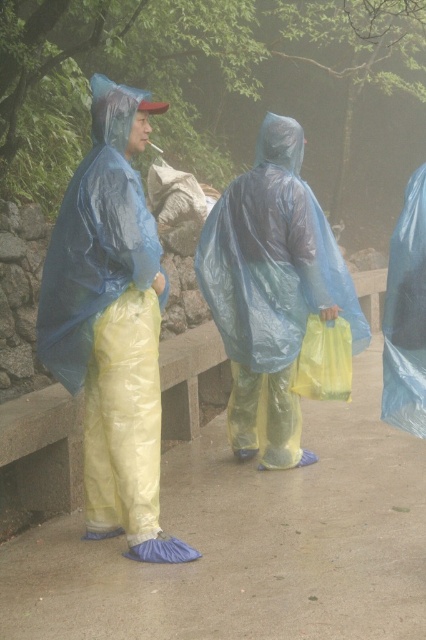
You are a photographer trying to capture the person in the matte blue raincoat at left. Given that the camera is focused on the point at coordinates (x=112, y=324), will the person in the matte blue raincoat at left be in focus?

The matte blue raincoat at left is represented by point (x=112, y=324), so yes, the person in the matte blue raincoat at left will be in focus since the camera is focused on that exact point.

You are a delivery person trying to locate the matte blue raincoat at left in a misty park. Based on the coordinates provided, where should you look relative to the stone wall and concrete bench?

The matte blue raincoat at left is located at coordinates point [112,324], which is near the stone wall and concrete bench.

You are navigating through the misty park and need to reach a hidden treasure located at point (334, 301). There is an obstacle at point (106, 144). Will you encounter this obstacle before reaching the treasure?

Yes, you will encounter the obstacle at point (106, 144) before reaching the treasure at point (334, 301) because point (106, 144) is in front of point (334, 301).